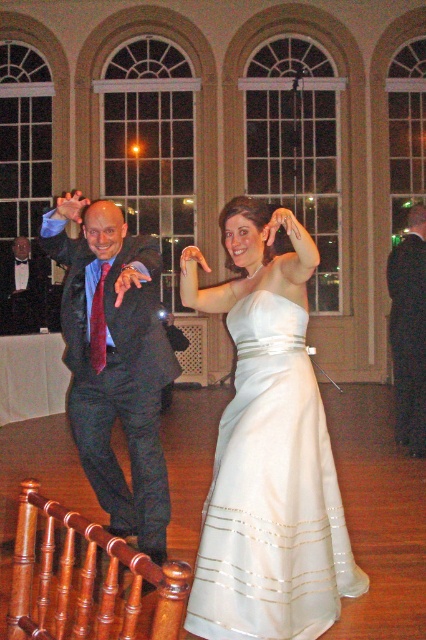
Question: Which point appears farthest from the camera in this image?

Choices:
 (A) (11, 308)
 (B) (149, 316)

Answer: (A)

Question: Is white satin dress at center behind matte black suit at upper left?

Choices:
 (A) no
 (B) yes

Answer: (A)

Question: Does white satin dress at center appear on the left side of dark gray suit at right?

Choices:
 (A) no
 (B) yes

Answer: (B)

Question: Considering the real-world distances, which object is farthest from the dark gray suit at right?

Choices:
 (A) white satin dress at center
 (B) matte white dress at center

Answer: (A)

Question: Which point is closer to the camera taking this photo?

Choices:
 (A) (91, 464)
 (B) (423, 436)

Answer: (A)

Question: Does white satin dress at center have a larger size compared to matte black suit at upper left?

Choices:
 (A) no
 (B) yes

Answer: (A)